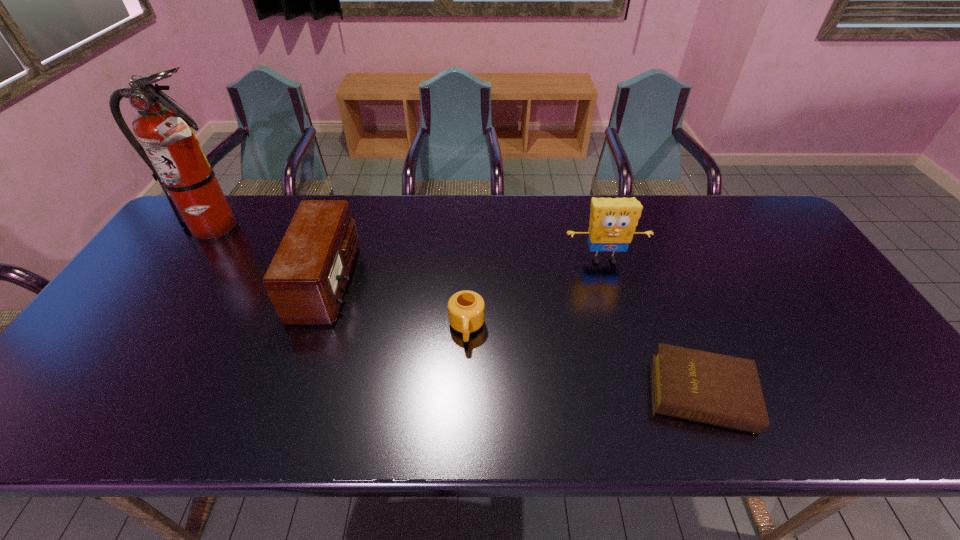
Find the location of a particular element. This screenshot has height=540, width=960. vacant space located 0.290m on the face of the sponge is located at coordinates (632, 356).

Find the location of a particular element. Image resolution: width=960 pixels, height=540 pixels. free region located 0.270m on the front-facing side of the third tallest object is located at coordinates [450, 281].

Where is `free location located on the handle side of the mug`? The image size is (960, 540). free location located on the handle side of the mug is located at coordinates (464, 438).

You are a GUI agent. You are given a task and a screenshot of the screen. Output one action in this format:
    pyautogui.click(x=<x>, y=<y>)
    Task: Click on the free location located 0.310m on the left of the Bible
    
    Given the screenshot: What is the action you would take?
    pyautogui.click(x=511, y=393)

Where is `object that is at the far edge`? The image size is (960, 540). object that is at the far edge is located at coordinates (170, 148).

At what (x,y) coordinates should I click in order to perform the action: click on object situated at the near edge. Please return your answer as a coordinate pair (x, y). Looking at the image, I should click on (721, 390).

Image resolution: width=960 pixels, height=540 pixels. In order to click on object that is at the left edge in this screenshot , I will do `click(170, 148)`.

Identify the location of object present at the far left corner. This screenshot has height=540, width=960. (170, 148).

Where is `free space at the far edge`? free space at the far edge is located at coordinates (368, 217).

The image size is (960, 540). I want to click on vacant space at the near edge, so click(379, 414).